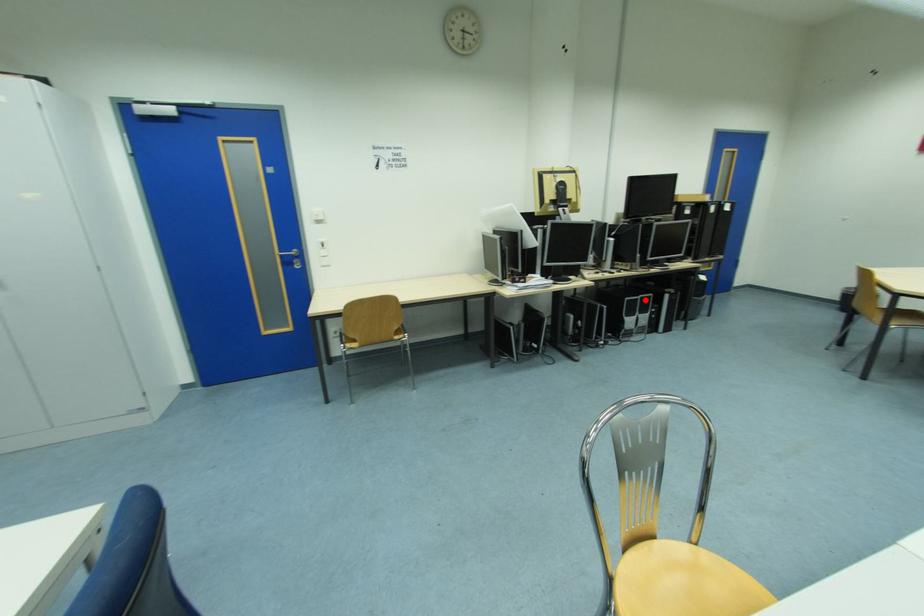
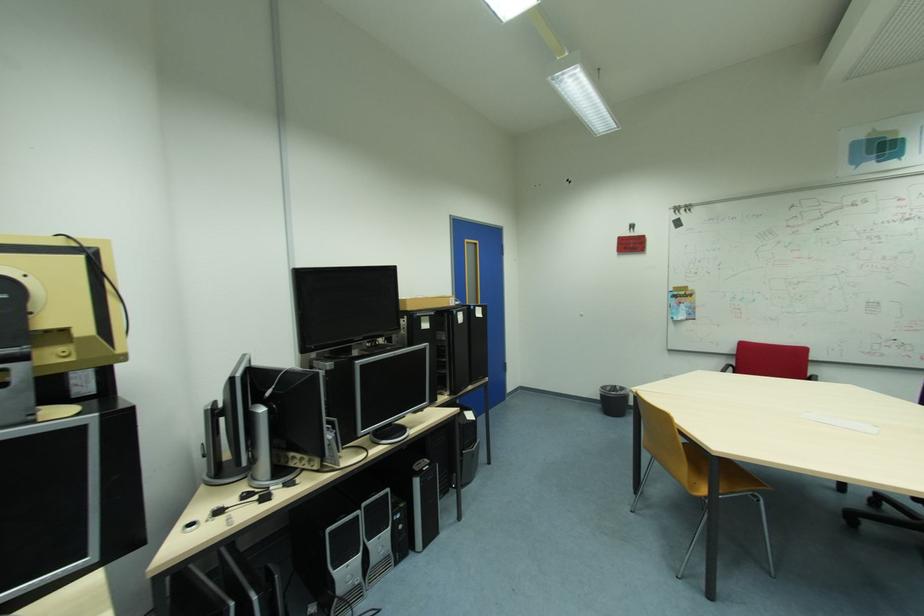
Where in the second image is the point corresponding to the highlighted location from the first image?

(365, 517)